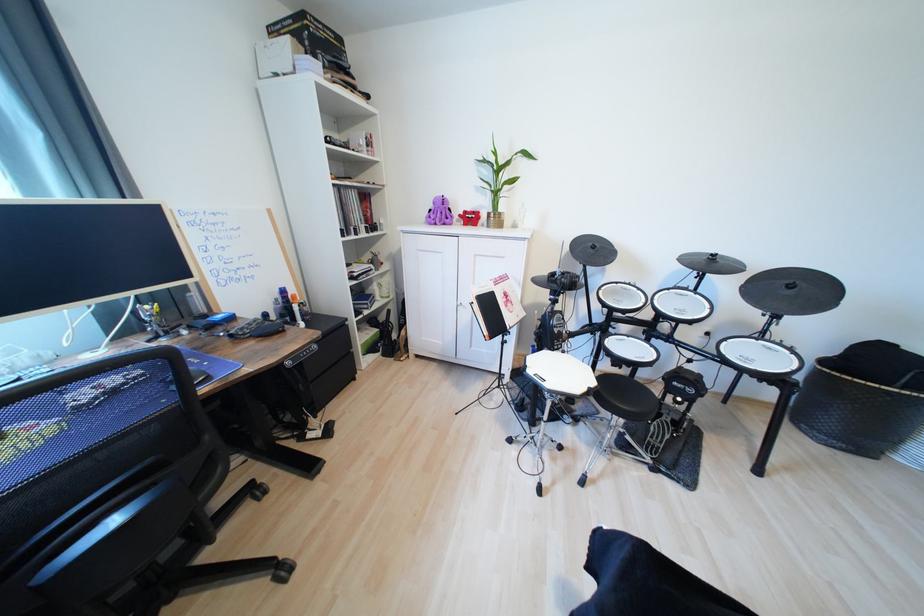
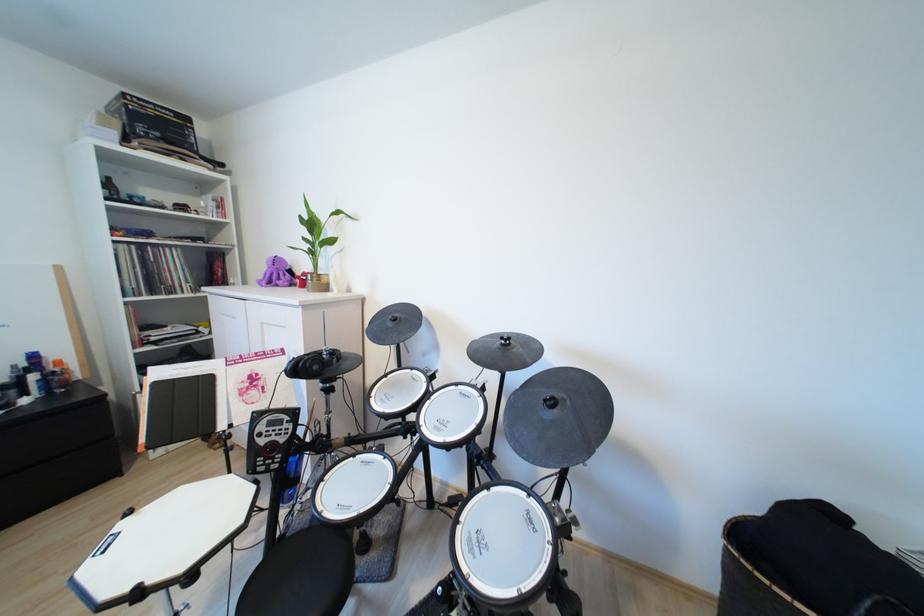
The point at [624,284] is marked in the first image. Where is the corresponding point in the second image?

(419, 370)